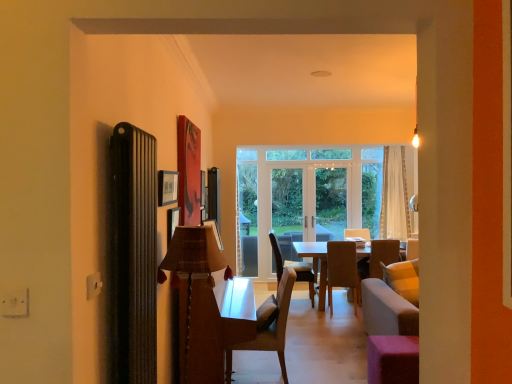
Question: Does pink fabric stool at lower right have a greater height compared to white glossy screen door at center, the 2th screen door viewed from the right?

Choices:
 (A) yes
 (B) no

Answer: (B)

Question: Could you tell me if pink fabric stool at lower right is turned towards white glossy screen door at center, the 2th screen door viewed from the right?

Choices:
 (A) no
 (B) yes

Answer: (A)

Question: From the image's perspective, would you say pink fabric stool at lower right is shown under white glossy screen door at center, the 2th screen door viewed from the right?

Choices:
 (A) no
 (B) yes

Answer: (B)

Question: Can you confirm if pink fabric stool at lower right is positioned to the left of white glossy screen door at center, the 2th screen door viewed from the right?

Choices:
 (A) yes
 (B) no

Answer: (B)

Question: Would you consider pink fabric stool at lower right to be distant from white glossy screen door at center, positioned as the first screen door in left-to-right order?

Choices:
 (A) yes
 (B) no

Answer: (A)

Question: Is the position of pink fabric stool at lower right more distant than that of white glossy screen door at center, the 2th screen door viewed from the right?

Choices:
 (A) no
 (B) yes

Answer: (A)

Question: From a real-world perspective, does light brown fabric chair at center, arranged as the 2th chair when viewed from the back, sit lower than plaid fabric lampshade at center?

Choices:
 (A) yes
 (B) no

Answer: (A)

Question: Does light brown fabric chair at center, the 3th chair in the left-to-right sequence, appear on the right side of plaid fabric lampshade at center?

Choices:
 (A) yes
 (B) no

Answer: (A)

Question: From the image's perspective, is light brown fabric chair at center, arranged as the 2th chair when viewed from the back, on plaid fabric lampshade at center?

Choices:
 (A) no
 (B) yes

Answer: (A)

Question: Would you consider light brown fabric chair at center, the 3th chair in the left-to-right sequence, to be distant from plaid fabric lampshade at center?

Choices:
 (A) no
 (B) yes

Answer: (B)

Question: Is light brown fabric chair at center, the 3th chair in the left-to-right sequence, looking in the opposite direction of plaid fabric lampshade at center?

Choices:
 (A) no
 (B) yes

Answer: (A)

Question: Does light brown fabric chair at center, arranged as the 2th chair when viewed from the back, appear on the left side of plaid fabric lampshade at center?

Choices:
 (A) no
 (B) yes

Answer: (A)

Question: Is white sheer curtain at center aimed at clear glass door at center, the second screen door when ordered from left to right?

Choices:
 (A) yes
 (B) no

Answer: (B)